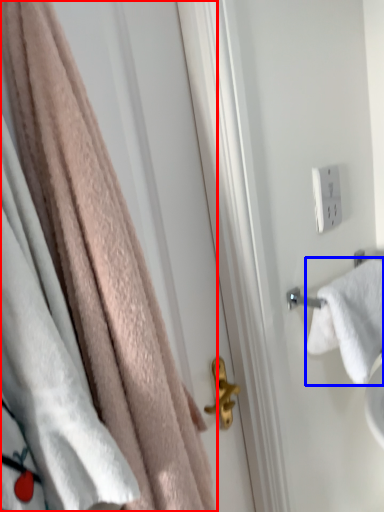
Question: Which object appears farthest to the camera in this image, towel (highlighted by a red box) or towel (highlighted by a blue box)?

Choices:
 (A) towel
 (B) towel

Answer: (B)